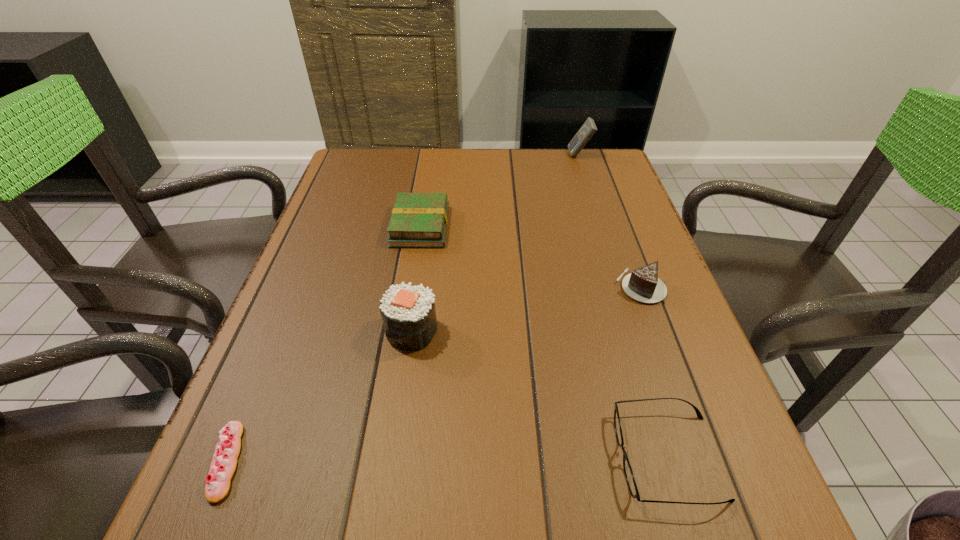
Find the location of a particular element. vacant area between the fifth tallest object and the farthest object is located at coordinates (623, 306).

Image resolution: width=960 pixels, height=540 pixels. What are the coordinates of `free area in between the spectacles and the tallest object` in the screenshot? It's located at (623, 306).

You are a GUI agent. You are given a task and a screenshot of the screen. Output one action in this format:
    pyautogui.click(x=<x>, y=<y>)
    Task: Click on the free space between the fourth nearest object and the fifth tallest object
    This screenshot has width=960, height=540.
    Given the screenshot: What is the action you would take?
    pyautogui.click(x=654, y=372)

Identify the location of vacant area that lies between the fifth nearest object and the tallest object. (500, 191).

You are a GUI agent. You are given a task and a screenshot of the screen. Output one action in this format:
    pyautogui.click(x=<x>, y=<y>)
    Task: Click on the free space between the leftmost object and the book
    The image size is (960, 540).
    Given the screenshot: What is the action you would take?
    pyautogui.click(x=324, y=343)

Locate an element on the screen. This screenshot has height=540, width=960. object that can be found as the second closest to the spectacles is located at coordinates (408, 312).

Select which object appears as the fourth closest to the second shortest object. Please provide its 2D coordinates. Your answer should be formatted as a tuple, i.e. [(x, y)], where the tuple contains the x and y coordinates of a point satisfying the conditions above.

[(223, 465)]

You are a GUI agent. You are given a task and a screenshot of the screen. Output one action in this format:
    pyautogui.click(x=<x>, y=<y>)
    Task: Click on the vacant space that satisfies the following two spatial constraints: 1. on the front-facing side of the calculator; 2. on the left side of the fourth nearest object
    The height and width of the screenshot is (540, 960).
    Given the screenshot: What is the action you would take?
    pyautogui.click(x=622, y=287)

Locate an element on the screen. free space that satisfies the following two spatial constraints: 1. on the front side of the second farthest object; 2. on the right side of the sushi is located at coordinates (403, 331).